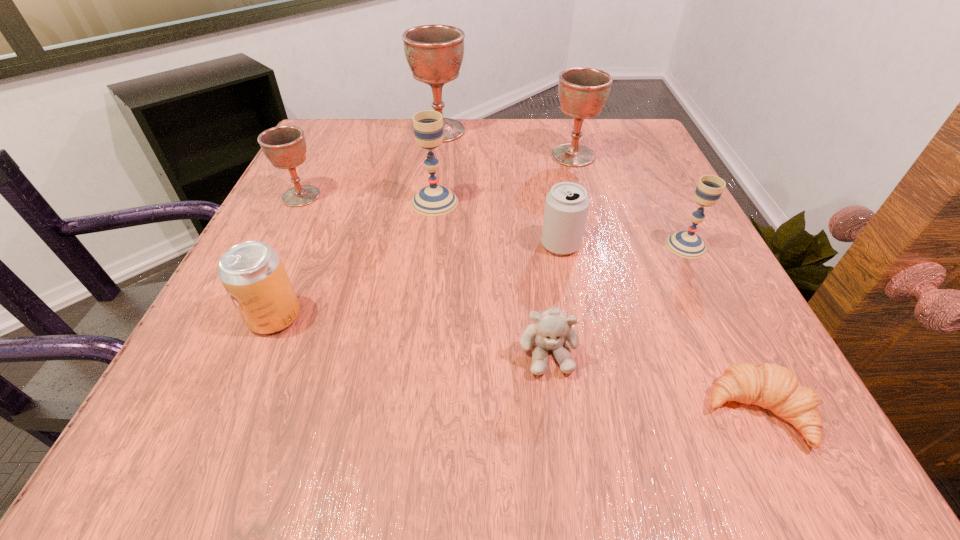
This screenshot has height=540, width=960. Find the location of `the biggest brown chalice`. the biggest brown chalice is located at coordinates (434, 53).

I want to click on the tallest chalice, so click(434, 53).

Identify the location of the second chalice from right to left. The image size is (960, 540). (583, 91).

At what (x,y) coordinates should I click in order to perform the action: click on the second smallest brown chalice. Please return your answer as a coordinate pair (x, y). The width and height of the screenshot is (960, 540). Looking at the image, I should click on (583, 91).

Image resolution: width=960 pixels, height=540 pixels. In order to click on the bigger gray chalice in this screenshot , I will do `click(433, 200)`.

At what (x,y) coordinates should I click in order to perform the action: click on the left gray chalice. Please return your answer as a coordinate pair (x, y). The height and width of the screenshot is (540, 960). Looking at the image, I should click on (433, 200).

You are a GUI agent. You are given a task and a screenshot of the screen. Output one action in this format:
    pyautogui.click(x=<x>, y=<y>)
    Task: Click on the smallest brown chalice
    This screenshot has height=540, width=960.
    Given the screenshot: What is the action you would take?
    pyautogui.click(x=284, y=146)

Locate an element on the screen. The height and width of the screenshot is (540, 960). the nearest brown chalice is located at coordinates (284, 146).

This screenshot has height=540, width=960. Identify the location of the right gray chalice. (686, 244).

I want to click on the smaller gray chalice, so click(686, 244).